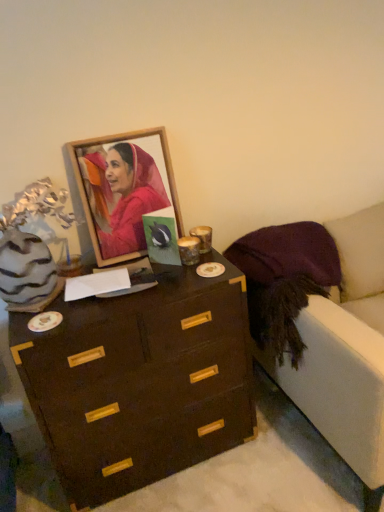
Question: Does wooden frame at upper center lie behind velvet purple armchair at right?

Choices:
 (A) yes
 (B) no

Answer: (A)

Question: Is wooden frame at upper center to the right of velvet purple armchair at right from the viewer's perspective?

Choices:
 (A) no
 (B) yes

Answer: (A)

Question: Is wooden frame at upper center shorter than velvet purple armchair at right?

Choices:
 (A) yes
 (B) no

Answer: (A)

Question: Is wooden frame at upper center positioned with its back to velvet purple armchair at right?

Choices:
 (A) yes
 (B) no

Answer: (B)

Question: Considering the relative sizes of wooden frame at upper center and velvet purple armchair at right in the image provided, is wooden frame at upper center taller than velvet purple armchair at right?

Choices:
 (A) no
 (B) yes

Answer: (A)

Question: From the image's perspective, is wooden frame at upper center beneath velvet purple armchair at right?

Choices:
 (A) no
 (B) yes

Answer: (A)

Question: Can you confirm if velvet purple armchair at right is smaller than dark wood chest of drawers at center?

Choices:
 (A) yes
 (B) no

Answer: (B)

Question: Is velvet purple armchair at right to the right of dark wood chest of drawers at center from the viewer's perspective?

Choices:
 (A) yes
 (B) no

Answer: (A)

Question: Is dark wood chest of drawers at center a part of velvet purple armchair at right?

Choices:
 (A) no
 (B) yes

Answer: (A)

Question: Are velvet purple armchair at right and dark wood chest of drawers at center making contact?

Choices:
 (A) no
 (B) yes

Answer: (A)

Question: Can you confirm if velvet purple armchair at right is bigger than dark wood chest of drawers at center?

Choices:
 (A) no
 (B) yes

Answer: (B)

Question: Is velvet purple armchair at right taller than dark wood chest of drawers at center?

Choices:
 (A) yes
 (B) no

Answer: (A)

Question: Considering the relative sizes of wooden frame at upper center and dark wood chest of drawers at center in the image provided, is wooden frame at upper center shorter than dark wood chest of drawers at center?

Choices:
 (A) no
 (B) yes

Answer: (B)